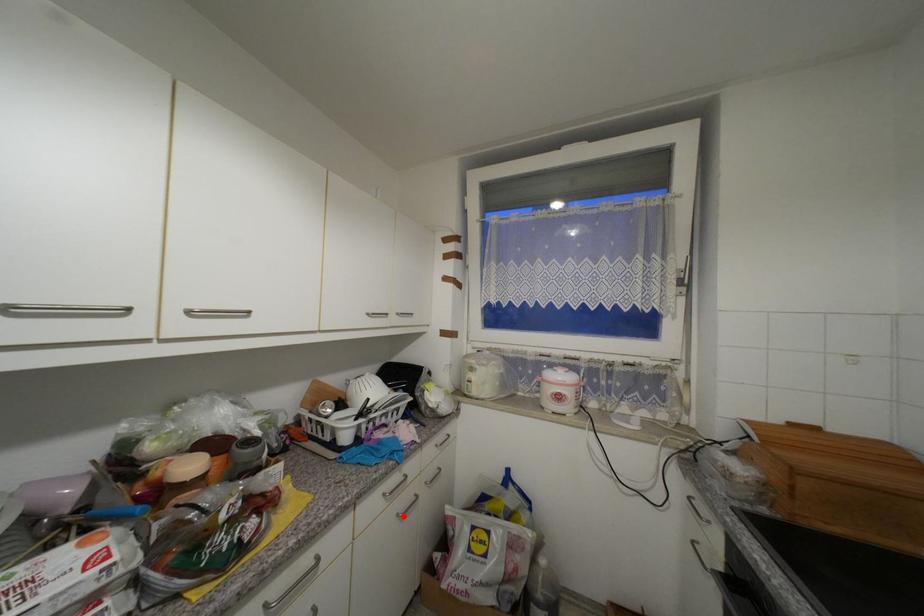
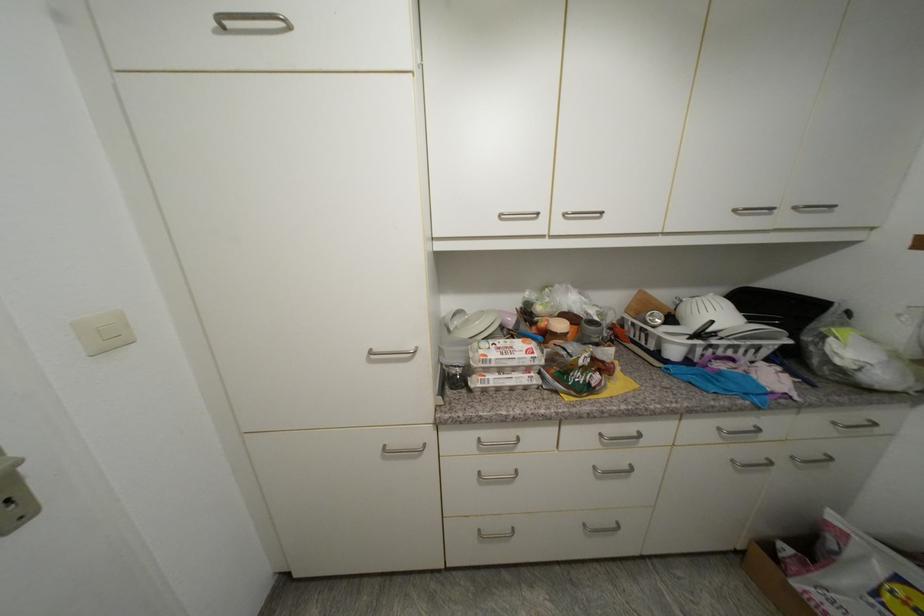
Question: A red point is marked in image1. In image2, is the corresponding 3D point closer to the camera or farther? Reply with the corresponding letter.

Choices:
 (A) The corresponding 3D point is closer.
 (B) The corresponding 3D point is farther.

Answer: (A)